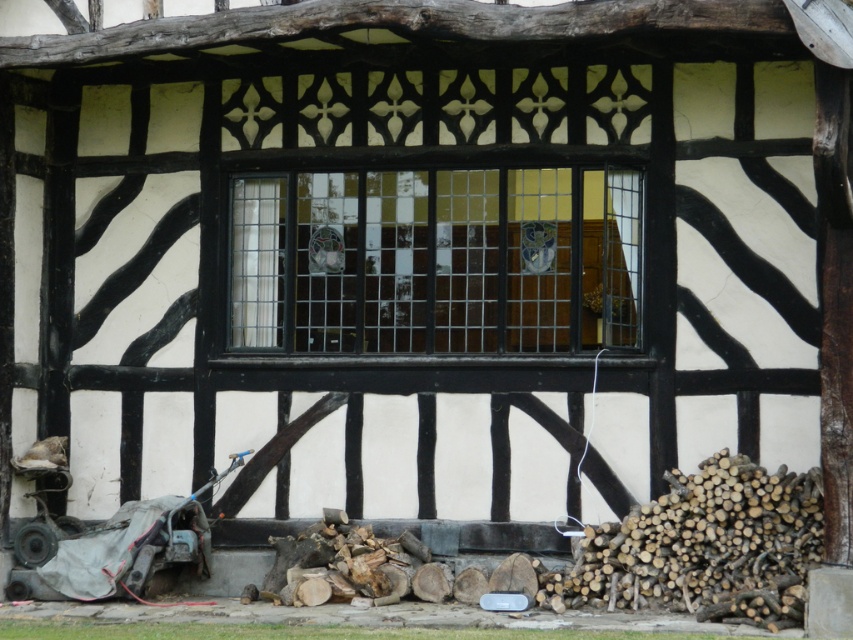
You are standing in front of a traditional half timbered building. You notice two points marked on the structure. One is at point (601,237) and the other is at point (213,474). Which point is closer to you?

Point (601,237) is closer to the viewer than point (213,474).